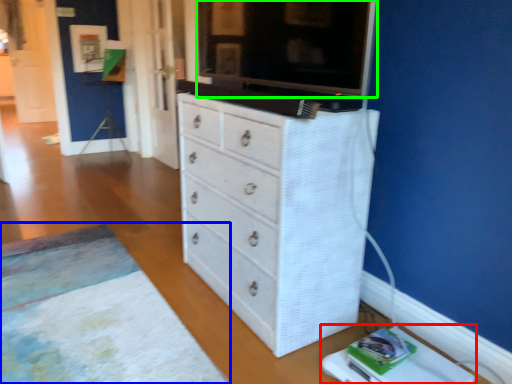
Question: Considering the real-world distances, which object is farthest from changing table (highlighted by a red box)? plain (highlighted by a blue box) or tv cabinet (highlighted by a green box)?

Choices:
 (A) plain
 (B) tv cabinet

Answer: (B)